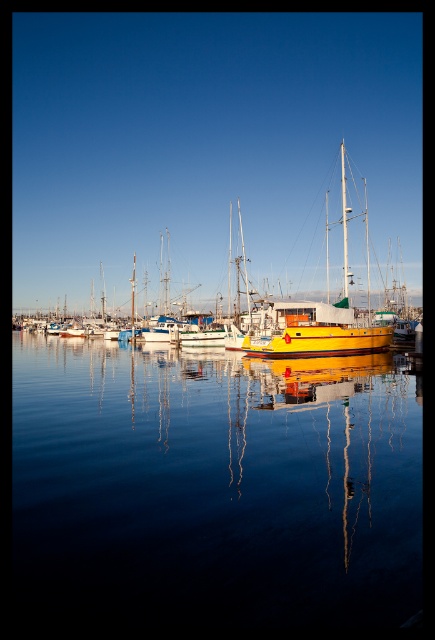
You are standing at the edge of the marina looking out at the boats. There are two points marked on the water surface in front of you. The first point is at coordinates point (334, 401) and the second is at point (317, 339). If you were to throw a small floating marker into the water, which point would appear closer to you when viewed from your current position?

Point (334, 401) would appear closer to you because it is physically closer to the camera than point (317, 339) according to the spatial description provided.